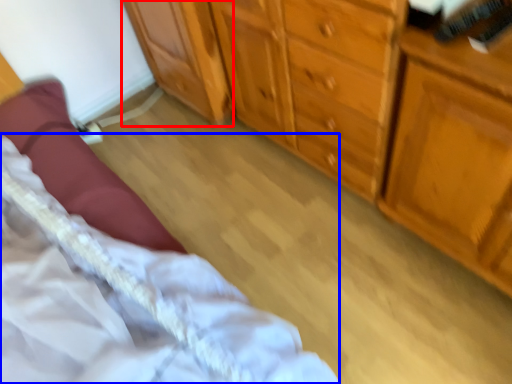
Question: Which object is closer to the camera taking this photo, cabinetry (highlighted by a red box) or bed (highlighted by a blue box)?

Choices:
 (A) cabinetry
 (B) bed

Answer: (B)